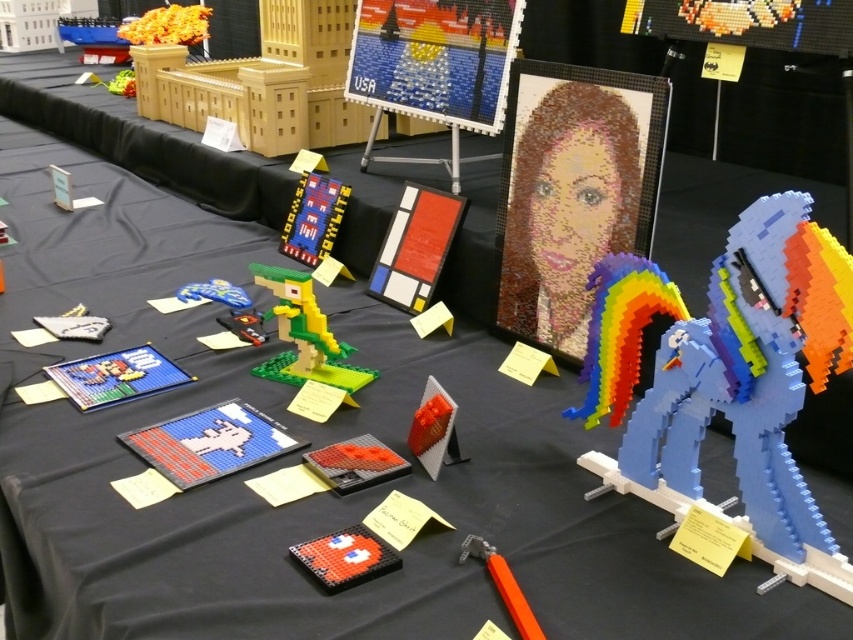
What is located at the coordinates point (344, 557) on the display table?

At point (344, 557) lies the matte red brick at center.

You are an art curator planning to move the translucent orange cube at center and the orange matte building at upper left to a new exhibition space. The new space has a limited height clearance of 1.2 meters. Can both items be moved without any modifications?

The translucent orange cube at center is positioned under the orange matte building at upper left, but their individual heights are not specified. Without knowing their exact dimensions, it is impossible to determine if they can fit under the 1.2 meter height clearance. Additional measurements are required.

You are standing at the display table and want to locate two specific points marked on the table. The first point is at coordinate point (444,392) and the second is at point (144,36). Which point is closer to you when viewed from your standing position?

Point (444,392) is in front of point (144,36), so it is closer to you when viewed from your standing position.